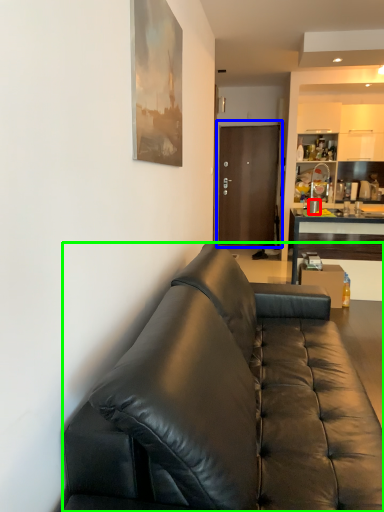
Question: Based on their relative distances, which object is nearer to coffee cup (highlighted by a red box)? Choose from door (highlighted by a blue box) and studio couch (highlighted by a green box).

Choices:
 (A) door
 (B) studio couch

Answer: (A)